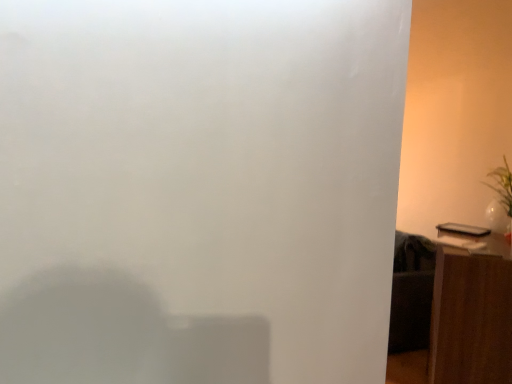
Question: Considering the positions of white glossy vase at right and brown wood side table at right in the image, is white glossy vase at right bigger or smaller than brown wood side table at right?

Choices:
 (A) small
 (B) big

Answer: (A)

Question: Considering their positions, is white glossy vase at right located in front of or behind brown wood side table at right?

Choices:
 (A) front
 (B) behind

Answer: (B)

Question: From a real-world perspective, is white glossy vase at right positioned above or below brown wood side table at right?

Choices:
 (A) above
 (B) below

Answer: (A)

Question: From the image's perspective, is brown wood side table at right located above or below white glossy vase at right?

Choices:
 (A) above
 (B) below

Answer: (B)

Question: In the image, is brown wood side table at right positioned in front of or behind white glossy vase at right?

Choices:
 (A) behind
 (B) front

Answer: (B)

Question: Considering the positions of point (481, 261) and point (501, 175), is point (481, 261) closer or farther from the camera than point (501, 175)?

Choices:
 (A) farther
 (B) closer

Answer: (B)

Question: From a real-world perspective, relative to white glossy vase at right, is brown wood side table at right vertically above or below?

Choices:
 (A) above
 (B) below

Answer: (B)